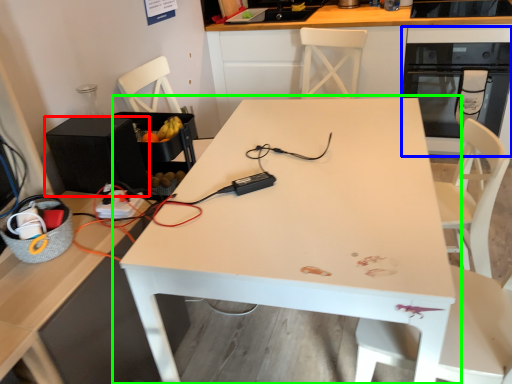
Question: Which object is positioned farthest from appliance (highlighted by a red box)? Select from oven (highlighted by a blue box) and table (highlighted by a green box).

Choices:
 (A) oven
 (B) table

Answer: (A)